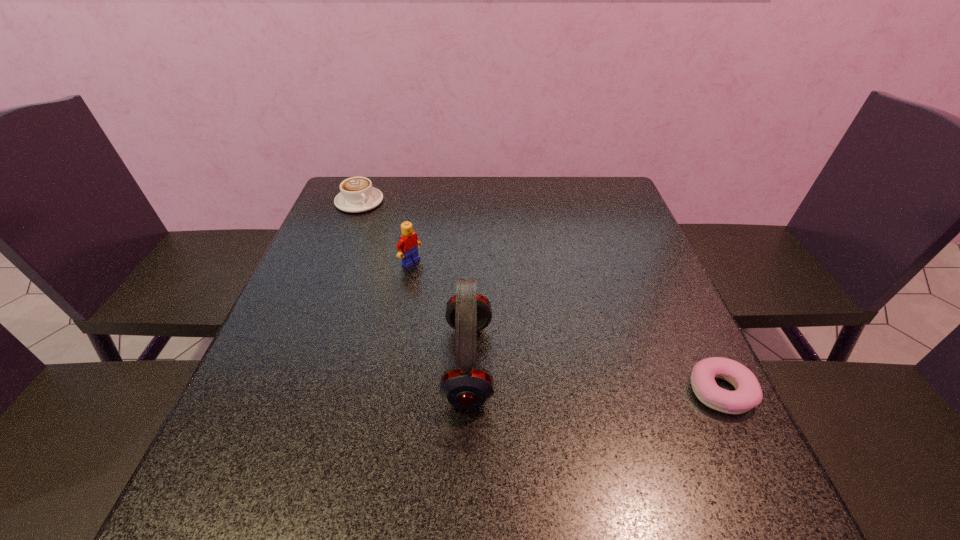
Identify the location of pastry present at the near edge. This screenshot has width=960, height=540. (748, 394).

Where is `object present at the left edge`? Image resolution: width=960 pixels, height=540 pixels. object present at the left edge is located at coordinates (357, 195).

Image resolution: width=960 pixels, height=540 pixels. In order to click on object positioned at the right edge in this screenshot , I will do `click(748, 394)`.

Find the location of a particular element. The height and width of the screenshot is (540, 960). object that is at the far left corner is located at coordinates tap(357, 195).

Find the location of `object located in the near right corner section of the desktop`. object located in the near right corner section of the desktop is located at coordinates (748, 394).

You are a GUI agent. You are given a task and a screenshot of the screen. Output one action in this format:
    pyautogui.click(x=<x>, y=<y>)
    Task: Click on the vacant space at the far edge
    
    Given the screenshot: What is the action you would take?
    pyautogui.click(x=467, y=193)

Identify the location of free space at the left edge of the desktop. (316, 406).

Find the location of a particular element. The height and width of the screenshot is (540, 960). blank space at the right edge of the desktop is located at coordinates (669, 316).

At what (x,y) coordinates should I click in order to perform the action: click on vacant space at the near left corner of the desktop. Please return your answer as a coordinate pair (x, y). The image size is (960, 540). Looking at the image, I should click on (295, 428).

In the image, there is a desktop. Identify the location of vacant space at the near right corner. This screenshot has width=960, height=540. (685, 419).